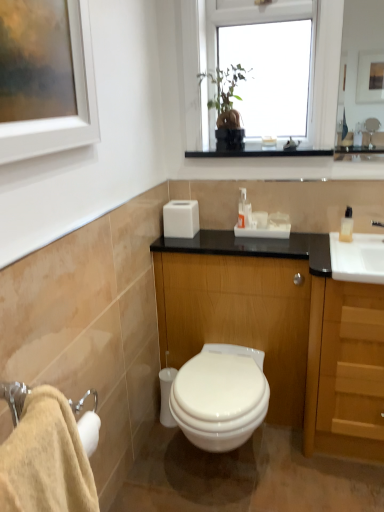
Image resolution: width=384 pixels, height=512 pixels. I want to click on free space to the left of white glossy toilet at center, so click(155, 464).